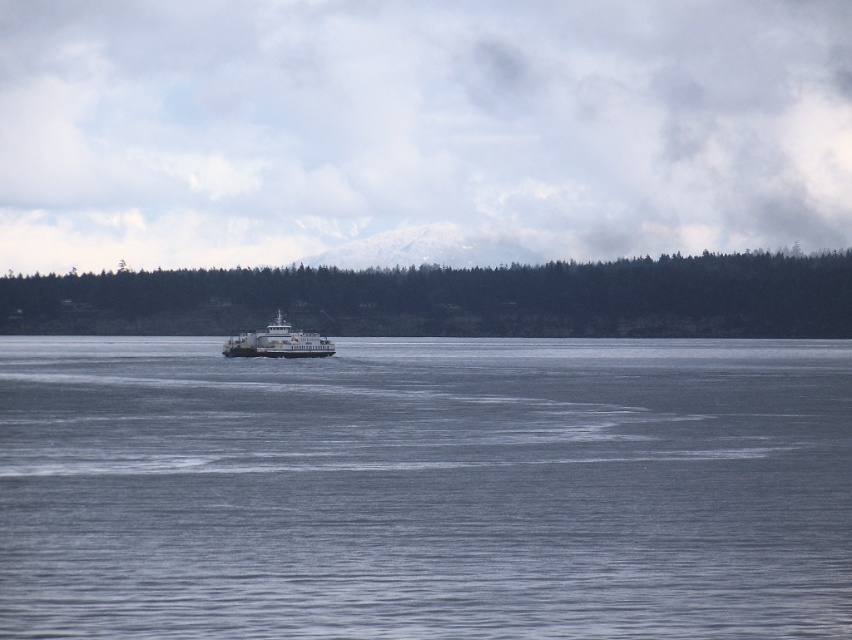
Does gray water at center lie behind dark green forest at center?

No, gray water at center is in front of dark green forest at center.

Locate an element on the screen. gray water at center is located at coordinates click(x=426, y=488).

You are a GUI agent. You are given a task and a screenshot of the screen. Output one action in this format:
    pyautogui.click(x=<x>, y=<y>)
    Task: Click on the gray water at center
    This screenshot has width=852, height=640.
    Given the screenshot: What is the action you would take?
    pyautogui.click(x=426, y=488)

This screenshot has width=852, height=640. I want to click on gray water at center, so click(426, 488).

Can you confirm if gray water at center is positioned below white matte ferry at center?

Indeed, gray water at center is positioned under white matte ferry at center.

Is point (112, 420) farther from viewer compared to point (294, 339)?

No, it is not.

I want to click on gray water at center, so click(x=426, y=488).

Between dark green forest at center and white matte ferry at center, which one has more height?

Standing taller between the two is dark green forest at center.

Is dark green forest at center positioned in front of white matte ferry at center?

No.

This screenshot has height=640, width=852. Find the location of `dark green forest at center`. dark green forest at center is located at coordinates (453, 300).

At what (x,y) coordinates should I click in order to perform the action: click on dark green forest at center. Please return your answer as a coordinate pair (x, y). The width and height of the screenshot is (852, 640). Looking at the image, I should click on point(453,300).